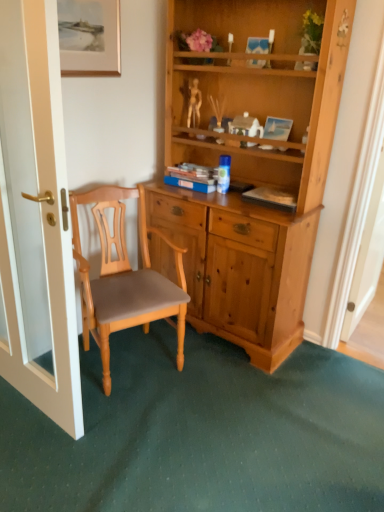
I want to click on vacant area that is in front of light brown wood chair at center, so click(128, 446).